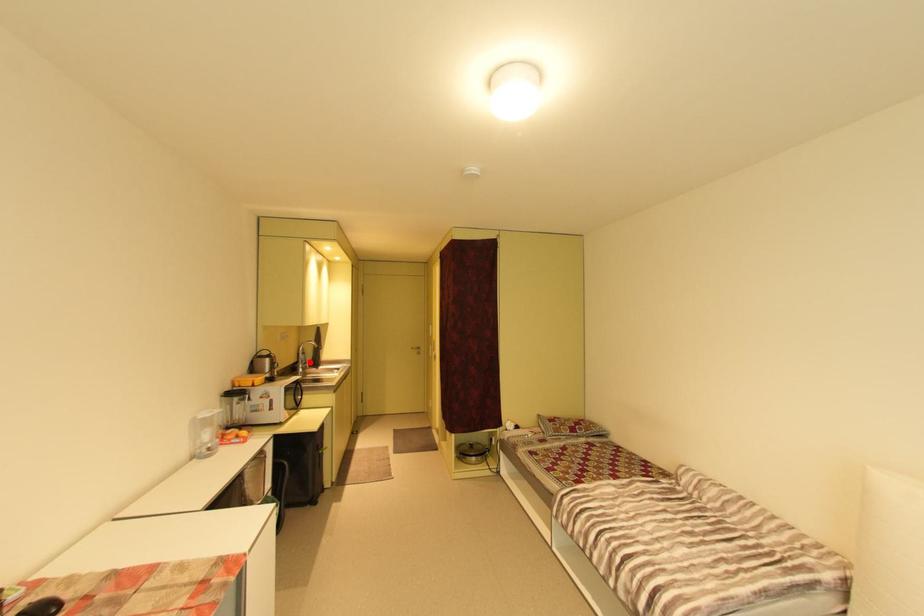
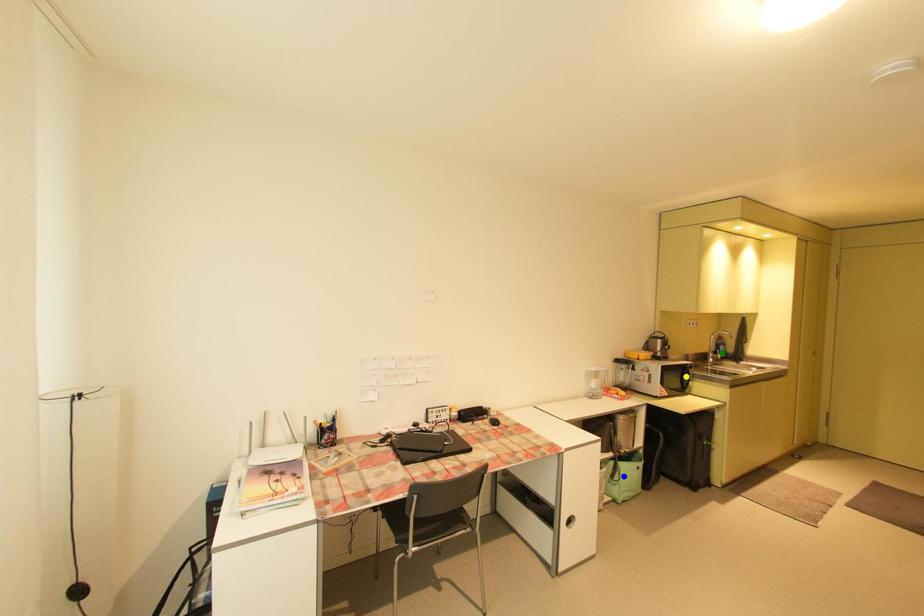
Question: I am providing you with two images of the same scene from different viewpoints. A red point is marked on the first image. You are given multiple points on the second image. Can you choose the point in image 2 that corresponds to the point in image 1?

Choices:
 (A) blue point
 (B) yellow point
 (C) green point

Answer: (C)